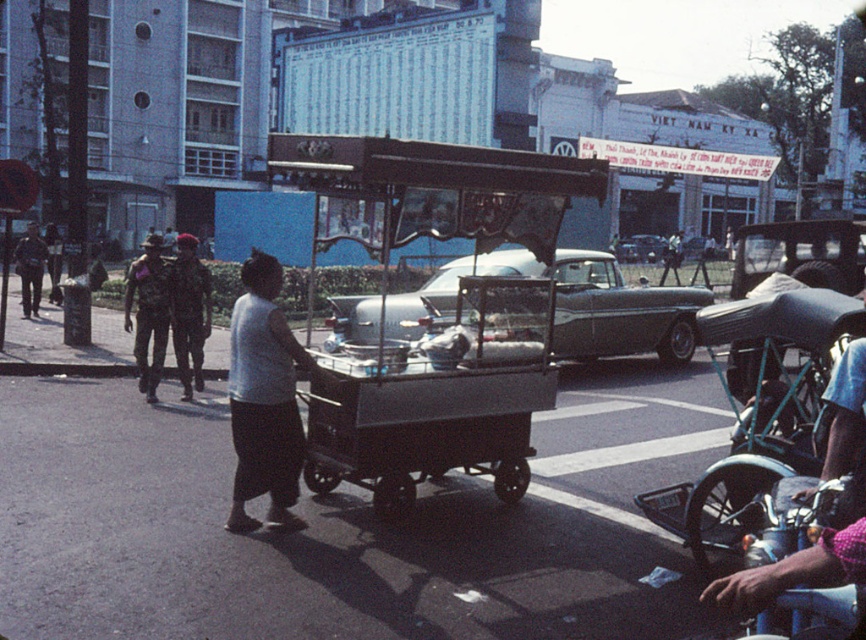
You are a photographer trying to capture both the camouflage fabric uniform at left and the camouflage uniform at left in a single frame. Which one should you focus on first to ensure both are in the frame?

The camouflage fabric uniform at left has a smaller size compared to camouflage uniform at left, so you should focus on the camouflage fabric uniform at left first to ensure both are in the frame.